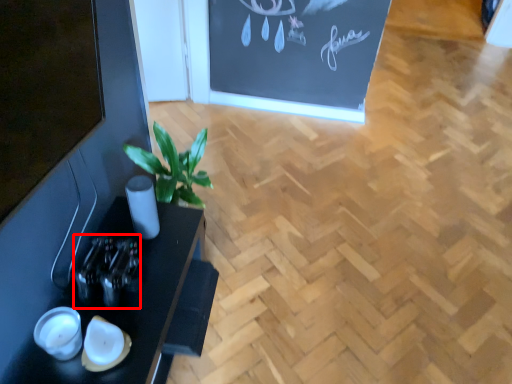
Question: Considering the relative positions of bottle (annotated by the red box) and table in the image provided, where is bottle (annotated by the red box) located with respect to the staircase?

Choices:
 (A) right
 (B) left

Answer: (A)